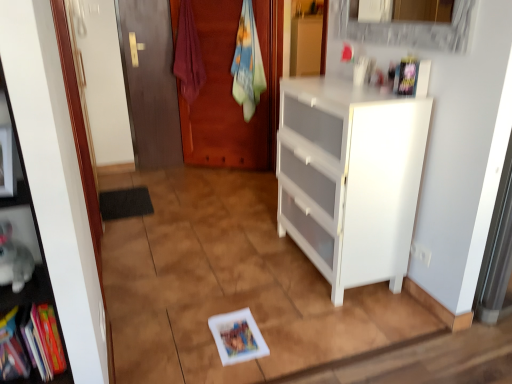
Locate an element on the screen. Image resolution: width=512 pixels, height=384 pixels. multicolored fabric towel at center, which is counted as the first laundry, starting from the right is located at coordinates (248, 64).

What do you see at coordinates (150, 82) in the screenshot? The height and width of the screenshot is (384, 512). I see `matte wood door at left` at bounding box center [150, 82].

You are a GUI agent. You are given a task and a screenshot of the screen. Output one action in this format:
    pyautogui.click(x=<x>, y=<y>)
    Task: Click on the white glossy cabinet at right, arranged as the 1th cabinetry when viewed from the front
    The width and height of the screenshot is (512, 384).
    Given the screenshot: What is the action you would take?
    pyautogui.click(x=350, y=178)

Locate an element on the screen. matte red towel at center, which is counted as the first laundry, starting from the left is located at coordinates pyautogui.click(x=188, y=55).

This screenshot has width=512, height=384. Identify the location of multicolored fabric towel at center, which appears as the second laundry when viewed from the left. coord(248,64).

Is white glossy cabinet at right, the second cabinetry in the back-to-front sequence, facing away from white glossy cabinet at upper center, the 2th cabinetry positioned from the front?

That's not correct — white glossy cabinet at right, the second cabinetry in the back-to-front sequence, is not looking away from white glossy cabinet at upper center, the 2th cabinetry positioned from the front.

The image size is (512, 384). Find the location of `cabinetry beneath the white glossy cabinet at upper center, the 2th cabinetry from the bottom (from a real-world perspective)`. cabinetry beneath the white glossy cabinet at upper center, the 2th cabinetry from the bottom (from a real-world perspective) is located at coordinates (350, 178).

Is white glossy cabinet at right, the second cabinetry in the back-to-front sequence, directly adjacent to white glossy cabinet at upper center, positioned as the first cabinetry in top-to-bottom order?

white glossy cabinet at right, the second cabinetry in the back-to-front sequence, and white glossy cabinet at upper center, positioned as the first cabinetry in top-to-bottom order, are clearly separated.

Does white glossy cabinet at right, which is counted as the 2th cabinetry, starting from the top, have a larger size compared to white glossy cabinet at upper center, positioned as the 1th cabinetry in back-to-front order?

Indeed, white glossy cabinet at right, which is counted as the 2th cabinetry, starting from the top, has a larger size compared to white glossy cabinet at upper center, positioned as the 1th cabinetry in back-to-front order.

Considering the relative positions of multicolored fabric towel at center, which appears as the second laundry when viewed from the left, and multicolored fabric book at lower left, which is the 3th book from top to bottom, in the image provided, is multicolored fabric towel at center, which appears as the second laundry when viewed from the left, to the left of multicolored fabric book at lower left, which is the 3th book from top to bottom, from the viewer's perspective?

No, multicolored fabric towel at center, which appears as the second laundry when viewed from the left, is not to the left of multicolored fabric book at lower left, which is the 3th book from top to bottom.

Would you consider multicolored fabric towel at center, which appears as the second laundry when viewed from the left, to be distant from multicolored fabric book at lower left, the fourth book in the right-to-left sequence?

That's right, there is a large distance between multicolored fabric towel at center, which appears as the second laundry when viewed from the left, and multicolored fabric book at lower left, the fourth book in the right-to-left sequence.

Considering the positions of objects multicolored fabric towel at center, which appears as the second laundry when viewed from the left, and multicolored fabric book at lower left, which is the 3th book from top to bottom, in the image provided, who is behind, multicolored fabric towel at center, which appears as the second laundry when viewed from the left, or multicolored fabric book at lower left, which is the 3th book from top to bottom,?

multicolored fabric towel at center, which appears as the second laundry when viewed from the left, is behind.

Between multicolored fabric towel at center, which is counted as the first laundry, starting from the right, and multicolored fabric book at lower left, which appears as the first book when viewed from the left, which one has more height?

Standing taller between the two is multicolored fabric towel at center, which is counted as the first laundry, starting from the right.

Is multicolored fabric towel at center, which is counted as the first laundry, starting from the right, positioned with its back to matte red towel at center, which is counted as the first laundry, starting from the left?

multicolored fabric towel at center, which is counted as the first laundry, starting from the right, does not have its back to matte red towel at center, which is counted as the first laundry, starting from the left.

Which is correct: multicolored fabric towel at center, which appears as the second laundry when viewed from the left, is inside matte red towel at center, the 2th laundry viewed from the right, or outside of it?

multicolored fabric towel at center, which appears as the second laundry when viewed from the left, is not enclosed by matte red towel at center, the 2th laundry viewed from the right.

Considering the positions of point (240, 83) and point (192, 55), is point (240, 83) closer or farther from the camera than point (192, 55)?

Point (240, 83) is positioned farther from the camera compared to point (192, 55).

From a real-world perspective, which object rests below the other?

multicolored fabric towel at center, which is counted as the first laundry, starting from the right, is physically lower.

From the image's perspective, is matte red towel at center, which is counted as the first laundry, starting from the left, over white matte book at center, which is the 3th book in left-to-right order?

Correct, matte red towel at center, which is counted as the first laundry, starting from the left, appears higher than white matte book at center, which is the 3th book in left-to-right order, in the image.

Is matte red towel at center, the 2th laundry viewed from the right, placed right next to white matte book at center, which is the first book from bottom to top?

No, matte red towel at center, the 2th laundry viewed from the right, is not making contact with white matte book at center, which is the first book from bottom to top.

Based on their sizes in the image, would you say matte red towel at center, the 2th laundry viewed from the right, is bigger or smaller than white matte book at center, which is the first book from bottom to top?

Clearly, matte red towel at center, the 2th laundry viewed from the right, is larger in size than white matte book at center, which is the first book from bottom to top.

Based on the photo, does hardcover book at left, marked as the third book in a bottom-to-top arrangement, have a greater height compared to matte wood door at left?

No, hardcover book at left, marked as the third book in a bottom-to-top arrangement, is not taller than matte wood door at left.

Which is closer, [59,366] or [146,55]?

Point [59,366] appears to be closer to the viewer than point [146,55].

Looking at this image, would you say hardcover book at left, the 2th book in the top-to-bottom sequence, contains matte wood door at left?

Definitely not — matte wood door at left is not inside hardcover book at left, the 2th book in the top-to-bottom sequence.

Is hardcover book at left, the third book when ordered from right to left, positioned far away from matte wood door at left?

Yes, hardcover book at left, the third book when ordered from right to left, and matte wood door at left are located far from each other.

Is point (184, 6) more distant than point (158, 69)?

No, (184, 6) is closer to viewer.

How many degrees apart are the facing directions of matte red towel at center, the 2th laundry viewed from the right, and matte wood door at left?

The facing directions of matte red towel at center, the 2th laundry viewed from the right, and matte wood door at left are 33.9 degrees apart.

Is matte red towel at center, which is counted as the first laundry, starting from the left, touching matte wood door at left?

No, matte red towel at center, which is counted as the first laundry, starting from the left, is not in contact with matte wood door at left.

Would you say white glossy cabinet at upper center, positioned as the 1th cabinetry in back-to-front order, is to the left or to the right of multicolored fabric book at lower left, the second book ordered from the bottom, in the picture?

In the image, white glossy cabinet at upper center, positioned as the 1th cabinetry in back-to-front order, appears on the right side of multicolored fabric book at lower left, the second book ordered from the bottom.

Is white glossy cabinet at upper center, positioned as the first cabinetry in top-to-bottom order, not close to multicolored fabric book at lower left, which is the 3th book from top to bottom?

Indeed, white glossy cabinet at upper center, positioned as the first cabinetry in top-to-bottom order, is not near multicolored fabric book at lower left, which is the 3th book from top to bottom.

Is white glossy cabinet at upper center, the 2th cabinetry from the bottom, wider than multicolored fabric book at lower left, which appears as the first book when viewed from the left?

Indeed, white glossy cabinet at upper center, the 2th cabinetry from the bottom, has a greater width compared to multicolored fabric book at lower left, which appears as the first book when viewed from the left.

At what (x,y) coordinates should I click in order to perform the action: click on cabinetry above the white glossy cabinet at right, which is counted as the 2th cabinetry, starting from the top (from a real-world perspective). Please return your answer as a coordinate pair (x, y). The image size is (512, 384). Looking at the image, I should click on (306, 45).

Where is `the 1st laundry behind the multicolored fabric book at lower left, which appears as the first book when viewed from the left, counting from the anchor's position`? The width and height of the screenshot is (512, 384). the 1st laundry behind the multicolored fabric book at lower left, which appears as the first book when viewed from the left, counting from the anchor's position is located at coordinates (248, 64).

Consider the image. Looking at the image, which one is located further to matte wood door at left, multicolored fabric book at lower left, which appears as the first book when viewed from the left, or matte purple book at upper right, the first book viewed from the top?

multicolored fabric book at lower left, which appears as the first book when viewed from the left.

Based on their spatial positions, is hardcover book at left, the 2th book in the top-to-bottom sequence, or multicolored fabric towel at center, which is counted as the first laundry, starting from the right, closer to black matte cabinet at left?

Based on the image, hardcover book at left, the 2th book in the top-to-bottom sequence, appears to be nearer to black matte cabinet at left.

Based on their spatial positions, is white matte book at center, acting as the 2th book starting from the right, or matte purple book at upper right, marked as the 1th book in a right-to-left arrangement, closer to hardcover book at left, placed as the second book when sorted from left to right?

white matte book at center, acting as the 2th book starting from the right.

When comparing their distances from multicolored fabric book at lower left, the second book ordered from the bottom, does multicolored fabric towel at center, which appears as the second laundry when viewed from the left, or black matte cabinet at left seem further?

multicolored fabric towel at center, which appears as the second laundry when viewed from the left.

From the image, which object appears to be nearer to hardcover book at left, the 2th book in the top-to-bottom sequence, multicolored fabric book at lower left, which is the 3th book from top to bottom, or white glossy cabinet at upper center, the 2th cabinetry from the bottom?

multicolored fabric book at lower left, which is the 3th book from top to bottom, is closer to hardcover book at left, the 2th book in the top-to-bottom sequence.

From the picture: Which object lies nearer to the anchor point matte purple book at upper right, the 4th book when ordered from bottom to top, white glossy cabinet at right, which is counted as the 2th cabinetry, starting from the top, or matte wood door at left?

white glossy cabinet at right, which is counted as the 2th cabinetry, starting from the top.

Looking at this image, based on their spatial positions, is multicolored fabric book at lower left, which appears as the first book when viewed from the left, or matte red towel at center, which is counted as the first laundry, starting from the left, further from black matte cabinet at left?

matte red towel at center, which is counted as the first laundry, starting from the left, lies further to black matte cabinet at left than the other object.

Based on their spatial positions, is matte wood door at left or black matte cabinet at left closer to hardcover book at left, placed as the second book when sorted from left to right?

black matte cabinet at left is closer to hardcover book at left, placed as the second book when sorted from left to right.

At what (x,y) coordinates should I click in order to perform the action: click on cabinetry between black matte cabinet at left and matte wood door at left in the front-back direction. Please return your answer as a coordinate pair (x, y). Image resolution: width=512 pixels, height=384 pixels. Looking at the image, I should click on (350, 178).

Find the location of a particular element. The height and width of the screenshot is (384, 512). door located between black matte cabinet at left and white glossy cabinet at upper center, the 2th cabinetry from the bottom, in the depth direction is located at coordinates (150, 82).

Where is `book positioned between matte purple book at upper right, which ranks as the fourth book in left-to-right order, and white glossy cabinet at upper center, positioned as the 1th cabinetry in back-to-front order, from near to far`? book positioned between matte purple book at upper right, which ranks as the fourth book in left-to-right order, and white glossy cabinet at upper center, positioned as the 1th cabinetry in back-to-front order, from near to far is located at coordinates (237, 337).

Find the location of a particular element. This screenshot has width=512, height=384. cabinetry between multicolored fabric book at lower left, which is the 3th book from top to bottom, and multicolored fabric towel at center, which is counted as the first laundry, starting from the right, along the z-axis is located at coordinates (350, 178).